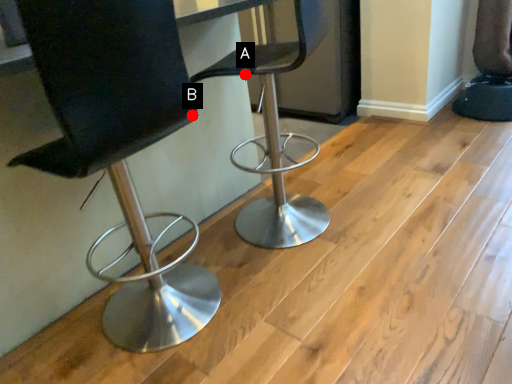
Question: Two points are circled on the image, labeled by A and B beside each circle. Which of the following is the closest to the observer?

Choices:
 (A) A is closer
 (B) B is closer

Answer: (B)